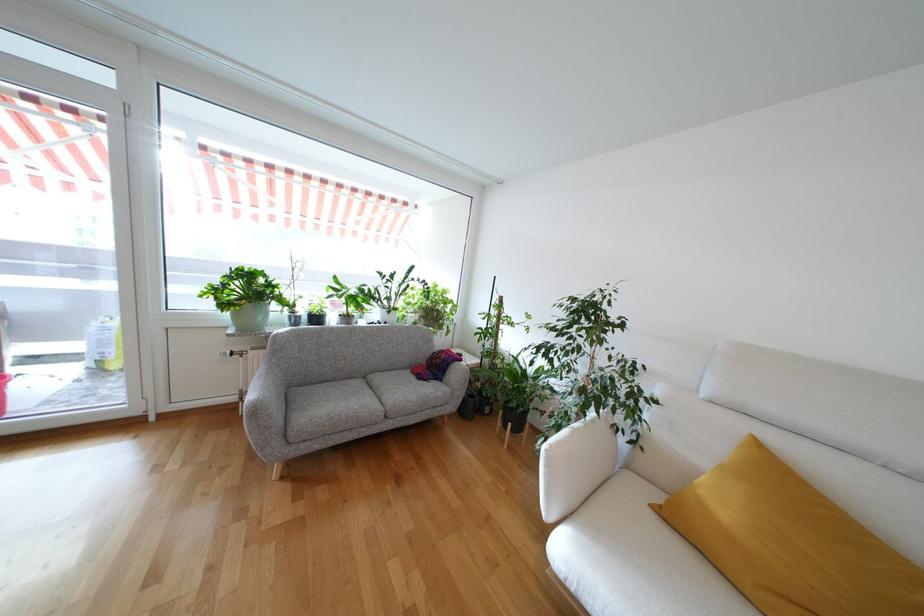
Where would you lift the grey plant pot? Please return your answer as a coordinate pair (x, y).

(250, 315)